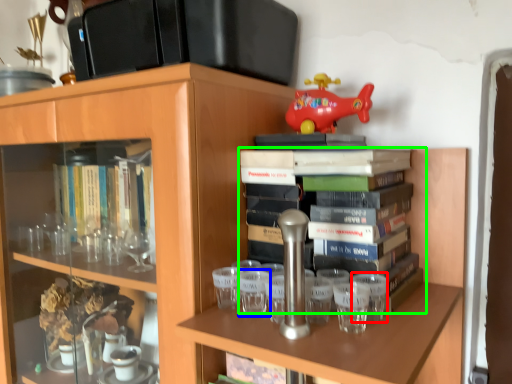
Question: Estimate the real-world distances between objects in this image. Which object is farther from shot glass (highlighted by a red box), shot glass (highlighted by a blue box) or book (highlighted by a green box)?

Choices:
 (A) shot glass
 (B) book

Answer: (A)